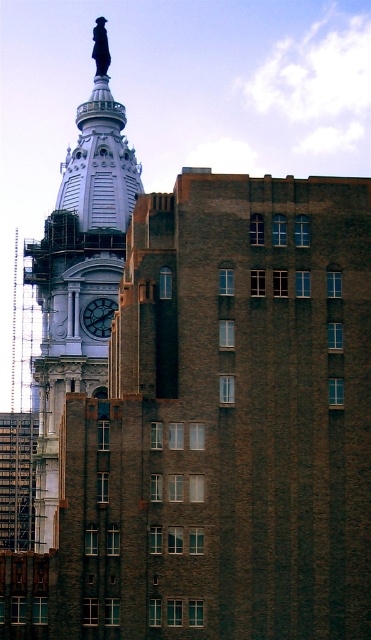
Does white stone clock tower at upper left have a lesser height compared to dark brown wooden clock at center-left?

No.

Based on the photo, is white stone clock tower at upper left smaller than dark brown wooden clock at center-left?

Incorrect, white stone clock tower at upper left is not smaller in size than dark brown wooden clock at center-left.

What do you see at coordinates (80, 269) in the screenshot? I see `white stone clock tower at upper left` at bounding box center [80, 269].

Locate an element on the screen. The image size is (371, 640). white stone clock tower at upper left is located at coordinates (80, 269).